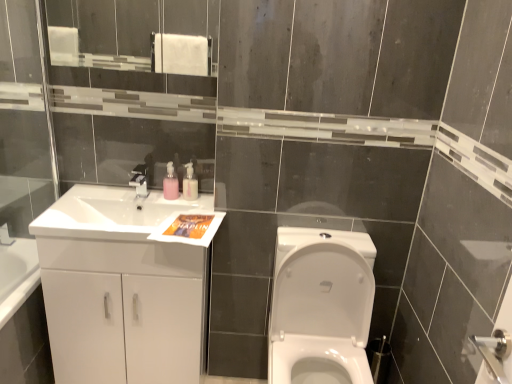
Where is `free spot in front of pink plastic soap dispenser at upper center, marked as the first soap dispenser in a right-to-left arrangement`? The image size is (512, 384). free spot in front of pink plastic soap dispenser at upper center, marked as the first soap dispenser in a right-to-left arrangement is located at coordinates (195, 214).